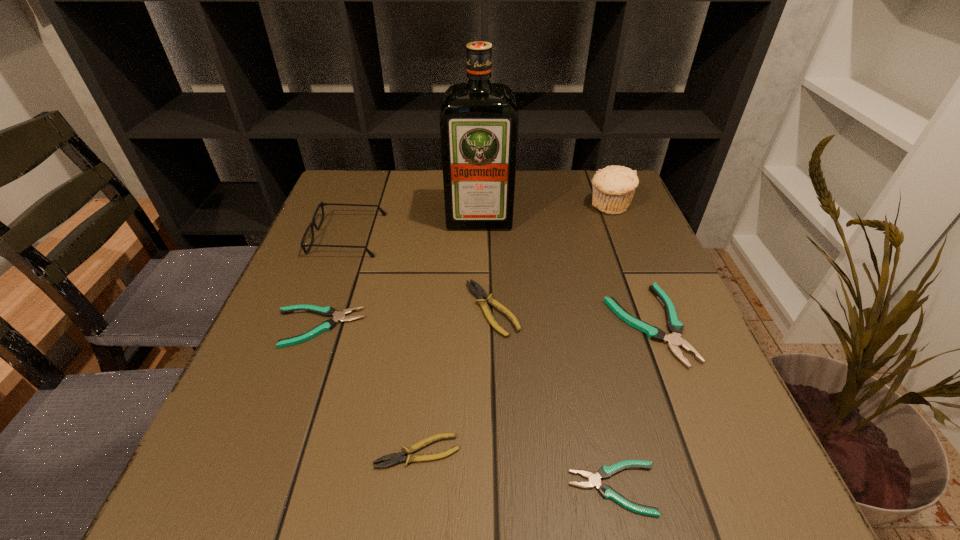
Find the location of a particular element. The image size is (960, 540). free space at the far edge of the desktop is located at coordinates (538, 214).

At what (x,y) coordinates should I click in order to perform the action: click on free space at the near edge of the desktop. Please return your answer as a coordinate pair (x, y). The height and width of the screenshot is (540, 960). Looking at the image, I should click on (619, 480).

The image size is (960, 540). What are the coordinates of `free space at the left edge of the desktop` in the screenshot? It's located at (343, 291).

Image resolution: width=960 pixels, height=540 pixels. What are the coordinates of `free spot at the right edge of the desktop` in the screenshot? It's located at click(x=654, y=354).

The width and height of the screenshot is (960, 540). Find the location of `vacant space at the far left corner of the desktop`. vacant space at the far left corner of the desktop is located at coordinates (x=371, y=199).

Locate an element on the screen. This screenshot has width=960, height=540. free space at the near left corner of the desktop is located at coordinates (264, 478).

Find the location of a particular element. The height and width of the screenshot is (540, 960). vacant space at the far right corner of the desktop is located at coordinates (580, 177).

You are a GUI agent. You are given a task and a screenshot of the screen. Output one action in this format:
    pyautogui.click(x=<x>, y=<y>)
    Task: Click on the free space at the near right corner
    This screenshot has width=960, height=540.
    Given the screenshot: What is the action you would take?
    pyautogui.click(x=767, y=475)

Where is `empty space that is in between the farther yellow pliers and the sixth shortest object`? Image resolution: width=960 pixels, height=540 pixels. empty space that is in between the farther yellow pliers and the sixth shortest object is located at coordinates (420, 272).

I want to click on vacant point located between the smaller yellow pliers and the beige muffin, so click(x=514, y=329).